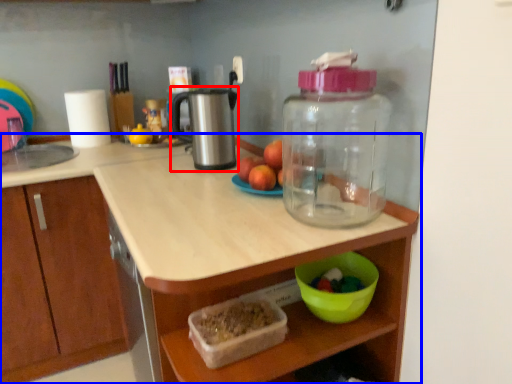
Question: Which point is further to the camera, appliance (highlighted by a red box) or countertop (highlighted by a blue box)?

Choices:
 (A) appliance
 (B) countertop

Answer: (B)